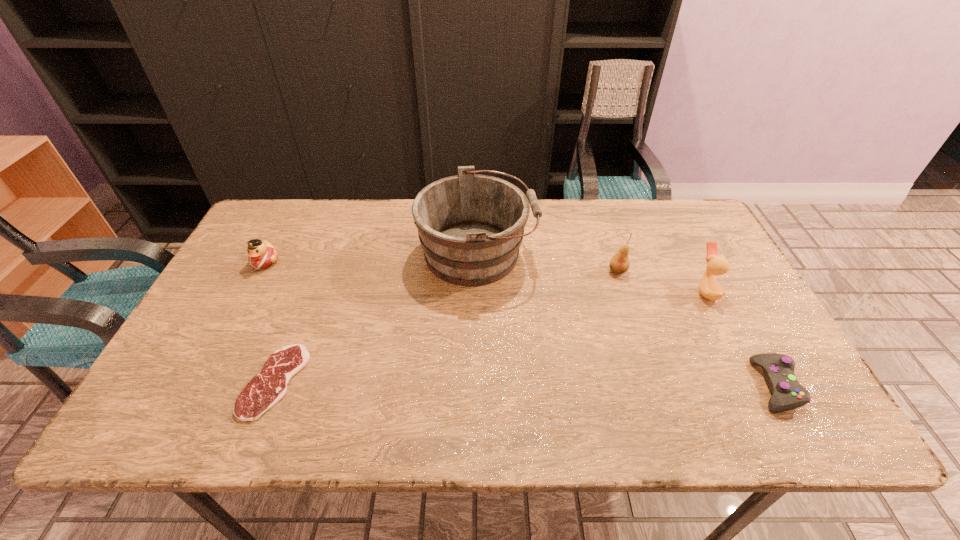
I want to click on steak located at the near edge, so click(x=269, y=386).

Where is `object at the left edge`? The image size is (960, 540). object at the left edge is located at coordinates click(262, 254).

I want to click on duck present at the right edge, so click(x=709, y=288).

Find the location of a particular element. control at the right edge is located at coordinates [778, 369].

This screenshot has width=960, height=540. I want to click on object located at the near right corner, so 778,369.

This screenshot has height=540, width=960. I want to click on vacant area at the far edge of the desktop, so 340,241.

You are a GUI agent. You are given a task and a screenshot of the screen. Output one action in this format:
    pyautogui.click(x=<x>, y=<y>)
    Task: Click on the free region at the near edge
    This screenshot has height=540, width=960.
    Given the screenshot: What is the action you would take?
    pyautogui.click(x=281, y=435)

You are a GUI agent. You are given a task and a screenshot of the screen. Output one action in this format:
    pyautogui.click(x=<x>, y=<y>)
    Task: Click on the vacant point at the right edge
    
    Given the screenshot: What is the action you would take?
    pyautogui.click(x=750, y=364)

This screenshot has width=960, height=540. I want to click on vacant space at the far right corner of the desktop, so click(x=663, y=209).

Where is `vacant area that lies between the control and the third shortest object`? The width and height of the screenshot is (960, 540). vacant area that lies between the control and the third shortest object is located at coordinates (519, 323).